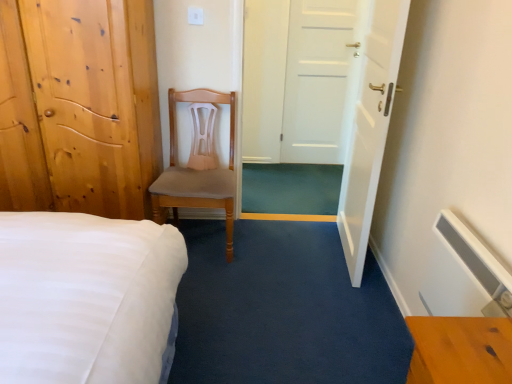
Where is `free region on the left part of white glossy door at center, the 3th door viewed from the left`? Image resolution: width=512 pixels, height=384 pixels. free region on the left part of white glossy door at center, the 3th door viewed from the left is located at coordinates (285, 242).